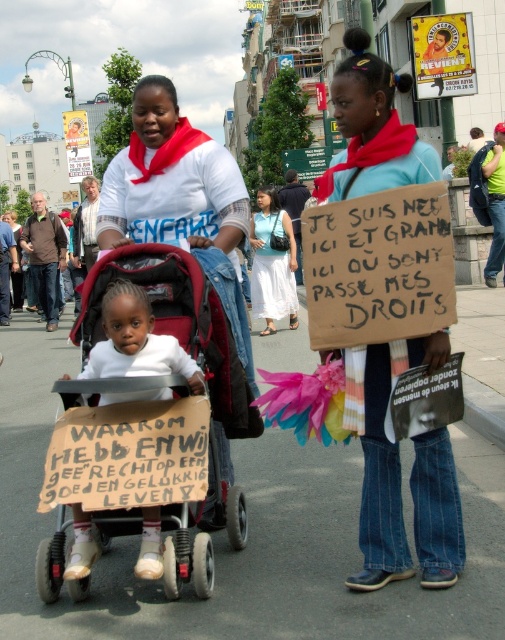
Who is higher up, blue denim jeans at center or matte plastic baby carriage at center?

blue denim jeans at center is above.

This screenshot has width=505, height=640. In order to click on blue denim jeans at center in this screenshot , I will do `click(373, 129)`.

Who is more distant from viewer, (192,259) or (268,298)?

Positioned behind is point (268,298).

Is matte plastic baby carriage at center bigger than white cotton dress at center?

No, matte plastic baby carriage at center is not bigger than white cotton dress at center.

Where is `matte plastic baby carriage at center`? This screenshot has width=505, height=640. matte plastic baby carriage at center is located at coordinates (184, 348).

You are a GUI agent. You are given a task and a screenshot of the screen. Output one action in this format:
    pyautogui.click(x=<x>, y=<y>)
    Task: Click on the matte plastic baby carriage at center
    The image size is (505, 640).
    Given the screenshot: What is the action you would take?
    pyautogui.click(x=184, y=348)

Which is below, blue denim jeans at center or white cotton dress at center?

white cotton dress at center is lower down.

Based on the photo, how much distance is there between blue denim jeans at center and white cotton dress at center?

4.35 meters

Between point (436, 339) and point (254, 228), which one is positioned in front?

Point (436, 339)

I want to click on blue denim jeans at center, so click(373, 129).